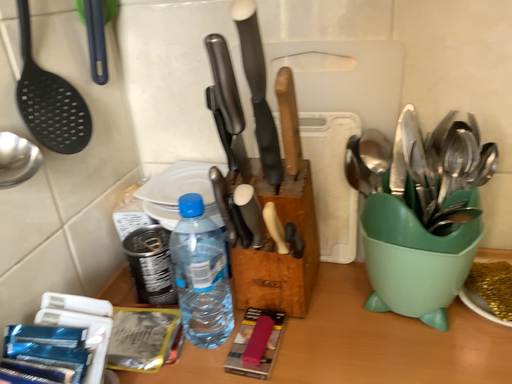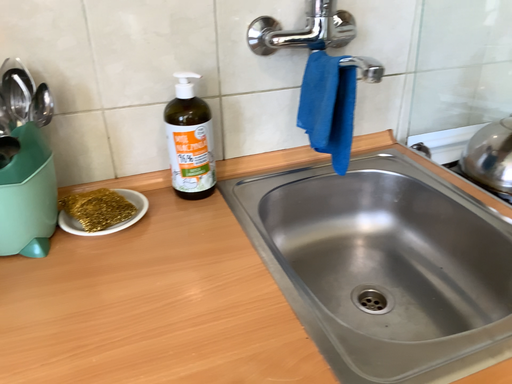
Question: Which way did the camera rotate in the video?

Choices:
 (A) rotated left
 (B) rotated right

Answer: (B)